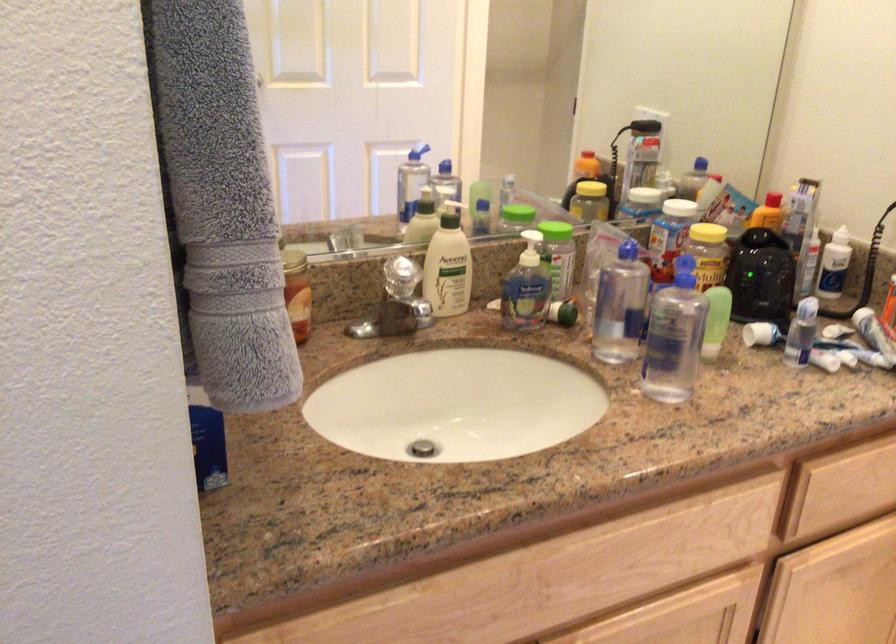
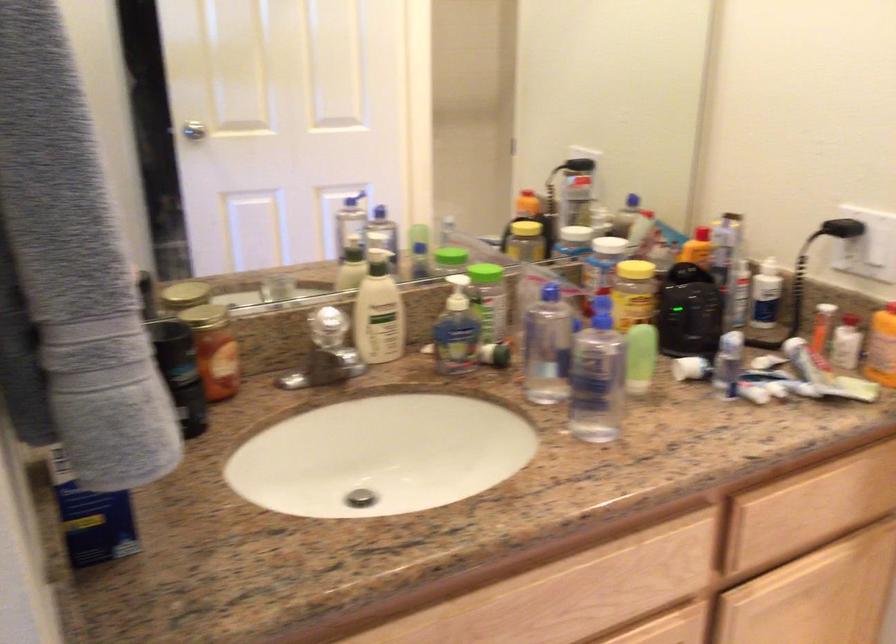
Question: In a continuous first-person perspective shot, in which direction is the camera moving?

Choices:
 (A) Left
 (B) Right
 (C) Forward
 (D) Backward

Answer: (B)